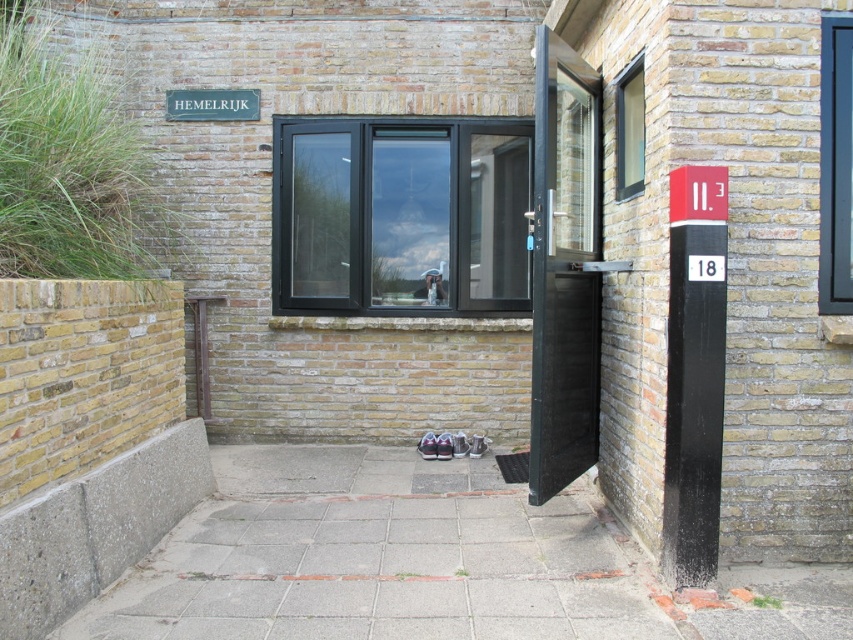
Question: Considering the relative positions of gray concrete pavement at lower center and black glass window at center in the image provided, where is gray concrete pavement at lower center located with respect to black glass window at center?

Choices:
 (A) right
 (B) left

Answer: (B)

Question: Which point is farther from the camera taking this photo?

Choices:
 (A) (374, 189)
 (B) (843, 129)

Answer: (A)

Question: Where is black glass door at center located in relation to black matte pole at right in the image?

Choices:
 (A) left
 (B) right

Answer: (A)

Question: Is black glass window at upper right closer to camera compared to transparent glass window at upper right?

Choices:
 (A) no
 (B) yes

Answer: (B)

Question: Estimate the real-world distances between objects in this image. Which object is farther from the gray concrete pavement at lower center?

Choices:
 (A) transparent glass window at upper right
 (B) black glass door at center

Answer: (A)

Question: Estimate the real-world distances between objects in this image. Which object is closer to the black glass window at upper right?

Choices:
 (A) green painted wood sign at upper left
 (B) transparent glass window at upper right

Answer: (B)